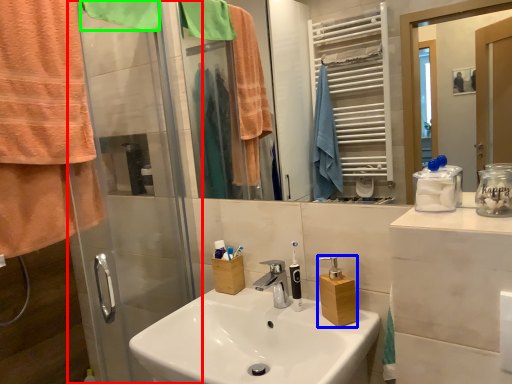
Question: Which object is the farthest from shower door (highlighted by a red box)? Choose among these: bottle (highlighted by a blue box) or towel/napkin (highlighted by a green box).

Choices:
 (A) bottle
 (B) towel/napkin

Answer: (A)